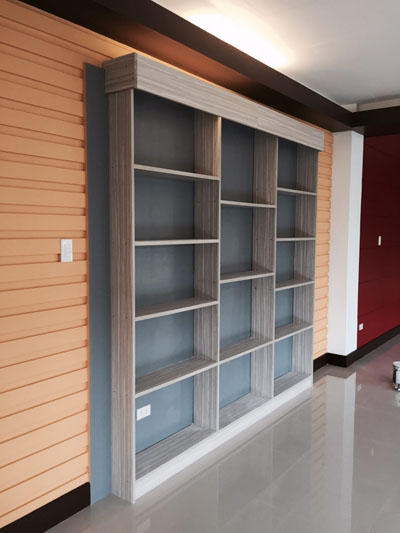
Locate an element on the screen. The height and width of the screenshot is (533, 400). book shelf is located at coordinates (249, 111).